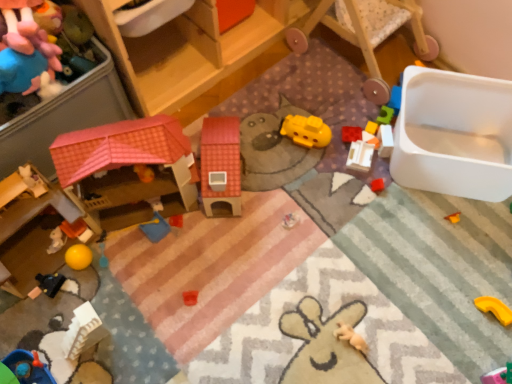
Locate an element on the screen. This screenshot has width=512, height=384. free space between yellow matte submarine at center, the 7th toy when ordered from right to left, and white plastic building at center-right, the eighth toy when ordered from left to right is located at coordinates (335, 150).